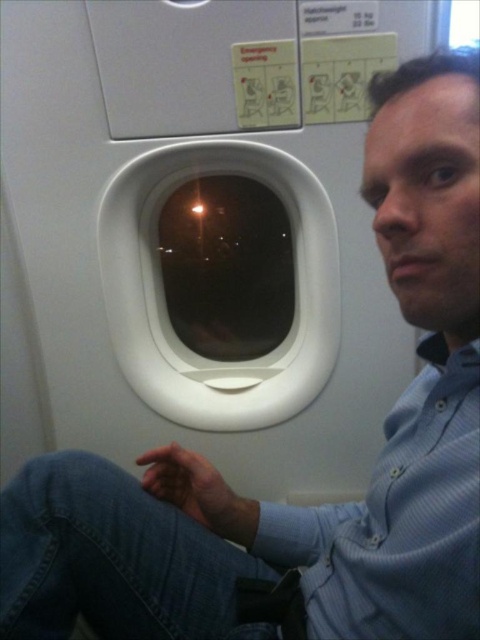
Question: From the image, what is the correct spatial relationship of blue striped shirt at right in relation to transparent glass airplane window at center?

Choices:
 (A) above
 (B) below

Answer: (B)

Question: Can you confirm if blue striped shirt at right is positioned to the left of transparent glass airplane window at center?

Choices:
 (A) no
 (B) yes

Answer: (A)

Question: Which point is farther from the camera taking this photo?

Choices:
 (A) (180, 400)
 (B) (373, 513)

Answer: (A)

Question: Which point is farther to the camera?

Choices:
 (A) (324, 561)
 (B) (147, 371)

Answer: (B)

Question: Which point is farther from the camera taking this photo?

Choices:
 (A) (432, 602)
 (B) (236, 384)

Answer: (B)

Question: Does blue striped shirt at right appear on the left side of transparent glass airplane window at center?

Choices:
 (A) yes
 (B) no

Answer: (B)